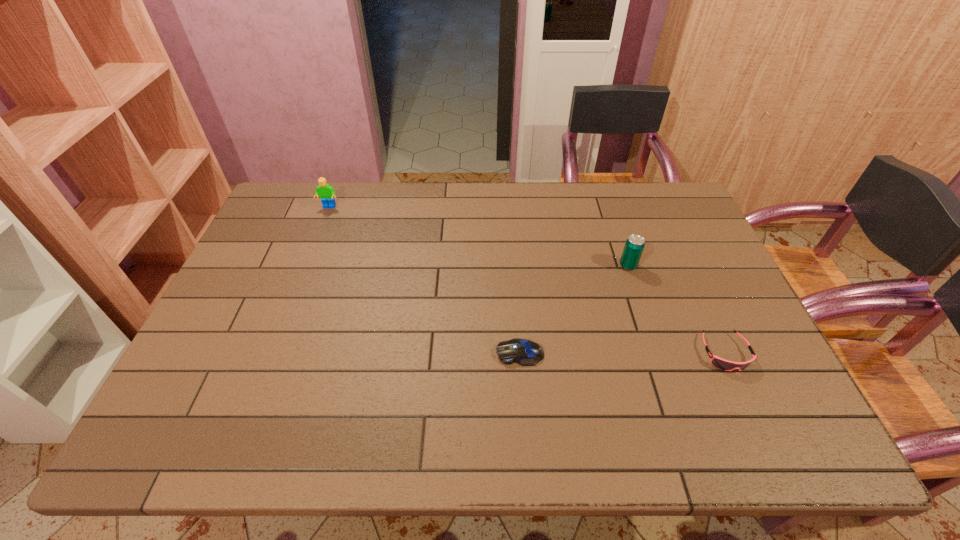
Locate an element on the screen. vacant region located on the front-facing side of the rightmost object is located at coordinates (756, 421).

At what (x,y) coordinates should I click in order to perform the action: click on free region located on the button side of the computer mouse. Please return your answer as a coordinate pair (x, y). This screenshot has width=960, height=540. Looking at the image, I should click on (386, 353).

You are a GUI agent. You are given a task and a screenshot of the screen. Output one action in this format:
    pyautogui.click(x=<x>, y=<y>)
    Task: Click on the vacant space located on the button side of the computer mouse
    This screenshot has height=540, width=960.
    Given the screenshot: What is the action you would take?
    pyautogui.click(x=395, y=353)

This screenshot has height=540, width=960. I want to click on free location located on the button side of the computer mouse, so click(451, 353).

Identify the location of object located at the far edge. pos(325,191).

The width and height of the screenshot is (960, 540). I want to click on object positioned at the left edge, so click(325, 191).

Locate an element on the screen. The image size is (960, 540). object positioned at the right edge is located at coordinates (723, 364).

Locate an element on the screen. The height and width of the screenshot is (540, 960). object positioned at the far left corner is located at coordinates (325, 191).

Locate an element on the screen. This screenshot has width=960, height=540. vacant space at the far edge is located at coordinates (628, 222).

The height and width of the screenshot is (540, 960). Find the location of `free space at the near edge of the desktop`. free space at the near edge of the desktop is located at coordinates (692, 427).